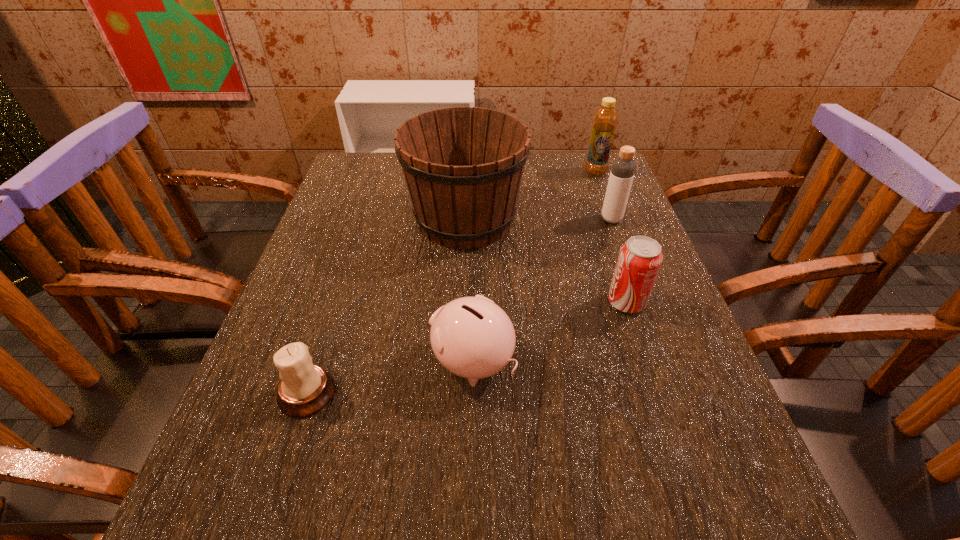
Find the location of a particular element. The width and height of the screenshot is (960, 540). vacant area located 0.190m on the logo side of the fourth farthest object is located at coordinates (516, 302).

At what (x,y) coordinates should I click in order to perform the action: click on blank space located on the logo side of the fourth farthest object. Please return your answer as a coordinate pair (x, y). Looking at the image, I should click on (511, 302).

Where is `vacant region located on the back of the piggy bank`? The width and height of the screenshot is (960, 540). vacant region located on the back of the piggy bank is located at coordinates (473, 279).

Where is `free space located 0.100m on the back of the candle holder`? The width and height of the screenshot is (960, 540). free space located 0.100m on the back of the candle holder is located at coordinates (328, 327).

At what (x,y) coordinates should I click in order to perform the action: click on wine bucket that is at the far edge. Please return your answer as a coordinate pair (x, y). The height and width of the screenshot is (540, 960). Looking at the image, I should click on (463, 166).

This screenshot has height=540, width=960. In order to click on bottle at the far edge in this screenshot , I will do `click(605, 119)`.

The height and width of the screenshot is (540, 960). I want to click on object located at the left edge, so click(304, 389).

The height and width of the screenshot is (540, 960). I want to click on soda can present at the right edge, so click(x=640, y=258).

Image resolution: width=960 pixels, height=540 pixels. Identify the location of object situated at the far right corner. (605, 119).

The width and height of the screenshot is (960, 540). What are the coordinates of `free space at the far edge of the desktop` in the screenshot? It's located at (521, 186).